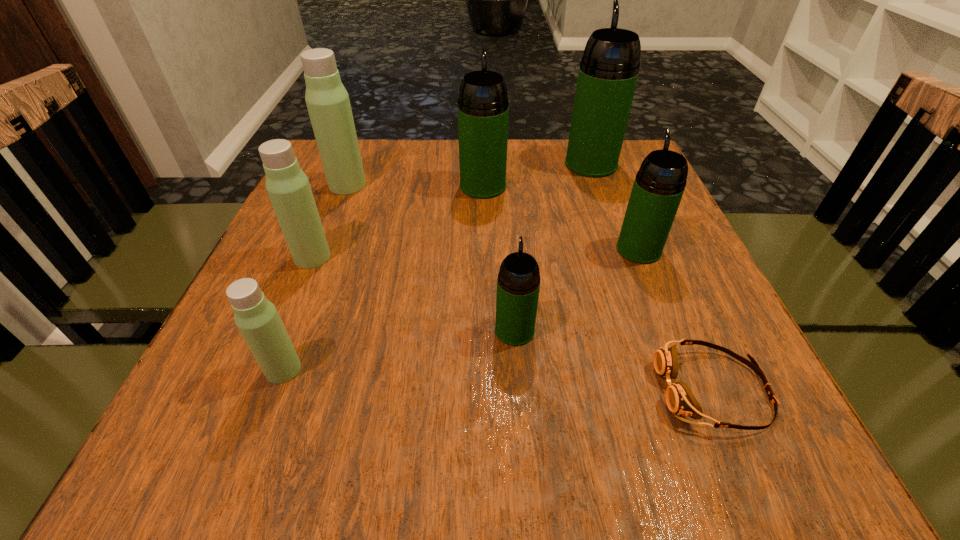
Find the location of a particular element. This screenshot has height=540, width=960. vacant space in between the biggest light thermos bottle and the third farthest green thermos bottle is located at coordinates click(x=493, y=217).

Choose which object is the second nearest neighbor to the second biggest green thermos bottle. Please provide its 2D coordinates. Your answer should be formatted as a tuple, i.e. [(x, y)], where the tuple contains the x and y coordinates of a point satisfying the conditions above.

[(328, 104)]

The height and width of the screenshot is (540, 960). Identify the location of object that stands as the closest to the third nearest object. (680, 400).

Image resolution: width=960 pixels, height=540 pixels. In order to click on thermos bottle that is the second closest one to the third smallest green thermos bottle in this screenshot , I will do `click(328, 104)`.

Locate which thermos bottle is the fourth closest to the smallest green thermos bottle. Please provide its 2D coordinates. Your answer should be formatted as a tuple, i.e. [(x, y)], where the tuple contains the x and y coordinates of a point satisfying the conditions above.

[(483, 108)]

Choose which green thermos bottle is the third nearest neighbor to the farthest light thermos bottle. Please provide its 2D coordinates. Your answer should be formatted as a tuple, i.e. [(x, y)], where the tuple contains the x and y coordinates of a point satisfying the conditions above.

[(608, 72)]

Where is `green thermos bottle that stands as the closest to the smallest light thermos bottle`? The width and height of the screenshot is (960, 540). green thermos bottle that stands as the closest to the smallest light thermos bottle is located at coordinates (518, 283).

Locate an element on the screen. The image size is (960, 540). light thermos bottle that is the closest to the second farthest light thermos bottle is located at coordinates (328, 104).

At what (x,y) coordinates should I click in order to perform the action: click on the third closest light thermos bottle to the third farthest green thermos bottle. Please return your answer as a coordinate pair (x, y). Image resolution: width=960 pixels, height=540 pixels. Looking at the image, I should click on (257, 319).

Find the location of a particular element. The image size is (960, 540). free space that satisfies the following two spatial constraints: 1. on the front side of the nearest thermos bottle; 2. on the left side of the farthest light thermos bottle is located at coordinates (275, 369).